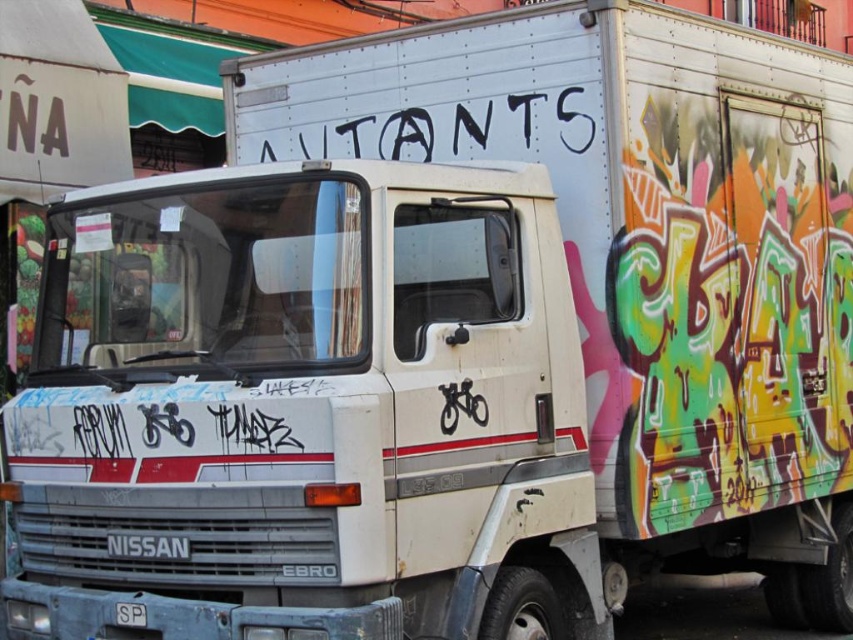
You are a graffiti artist standing in front of the white Nissan Ebro truck. You want to spray paint a new design on the truck. Which object, the black paint graffiti at upper center or the white plastic license plate at center, should you avoid painting over to keep your new design visible from the front?

You should avoid painting over the white plastic license plate at center because the black paint graffiti at upper center is closer to you, so painting over the license plate would be covered by the graffiti and less visible.

You are a graffiti artist who wants to add a new sticker to the white plastic license plate at center. However, you notice the black paint graffiti at upper center nearby. Based on their positions, can you place the sticker on the license plate without covering the graffiti?

The black paint graffiti at upper center is to the right of the white plastic license plate at center, so placing the sticker on the license plate at center won

You are a graffiti artist trying to add a new sticker to the truck. You have a sticker that is the same size as the white plastic license plate at center. Where on the truck can you place the sticker so it won the black paint graffiti at upper center?

The black paint graffiti at upper center has a larger size compared to the white plastic license plate at center. Therefore, the sticker can be placed anywhere except overlapping the black paint graffiti at upper center since the sticker is the same size as the smaller license plate and won